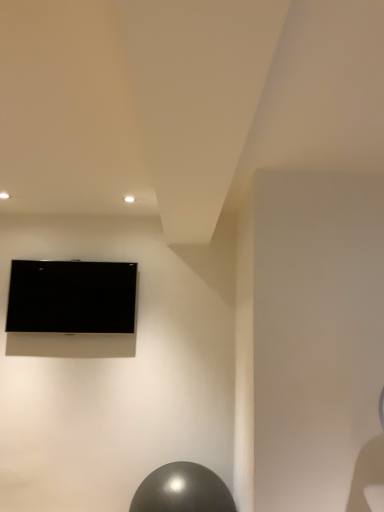
The width and height of the screenshot is (384, 512). Find the location of `black glossy tv at upper left`. black glossy tv at upper left is located at coordinates point(71,297).

What is the approximate height of black glossy tv at upper left?

The height of black glossy tv at upper left is 54.38 centimeters.

This screenshot has width=384, height=512. Describe the element at coordinates (71, 297) in the screenshot. I see `black glossy tv at upper left` at that location.

Image resolution: width=384 pixels, height=512 pixels. What do you see at coordinates (182, 490) in the screenshot?
I see `glossy metallic ball at lower center` at bounding box center [182, 490].

The width and height of the screenshot is (384, 512). In order to click on glossy metallic ball at lower center in this screenshot , I will do `click(182, 490)`.

Identify the location of black glossy tv at upper left. (71, 297).

Which is more to the left, black glossy tv at upper left or glossy metallic ball at lower center?

black glossy tv at upper left.

Does black glossy tv at upper left lie behind glossy metallic ball at lower center?

Yes, black glossy tv at upper left is further from the viewer.

Which is in front, point (39, 276) or point (209, 489)?

Positioned in front is point (209, 489).

From the image's perspective, which is below, black glossy tv at upper left or glossy metallic ball at lower center?

glossy metallic ball at lower center is shown below in the image.

From the picture: From a real-world perspective, is black glossy tv at upper left on glossy metallic ball at lower center?

Yes, from a real-world perspective, black glossy tv at upper left is above glossy metallic ball at lower center.

Can you confirm if black glossy tv at upper left is thinner than glossy metallic ball at lower center?

Indeed, black glossy tv at upper left has a lesser width compared to glossy metallic ball at lower center.

Considering the sizes of black glossy tv at upper left and glossy metallic ball at lower center in the image, is black glossy tv at upper left taller or shorter than glossy metallic ball at lower center?

black glossy tv at upper left is taller than glossy metallic ball at lower center.

Does black glossy tv at upper left have a smaller size compared to glossy metallic ball at lower center?

Correct, black glossy tv at upper left occupies less space than glossy metallic ball at lower center.

Could glossy metallic ball at lower center be considered to be inside black glossy tv at upper left?

Definitely not — glossy metallic ball at lower center is not inside black glossy tv at upper left.

Is black glossy tv at upper left with glossy metallic ball at lower center?

No.

Is black glossy tv at upper left positioned with its back to glossy metallic ball at lower center?

No.

How much distance is there between black glossy tv at upper left and glossy metallic ball at lower center?

3.96 feet.

The width and height of the screenshot is (384, 512). I want to click on ball in front of the black glossy tv at upper left, so click(182, 490).

In the image, is glossy metallic ball at lower center on the left side or the right side of black glossy tv at upper left?

glossy metallic ball at lower center is to the right of black glossy tv at upper left.

Between glossy metallic ball at lower center and black glossy tv at upper left, which one is positioned in front?

glossy metallic ball at lower center.

Considering the positions of point (177, 498) and point (131, 319), is point (177, 498) closer or farther from the camera than point (131, 319)?

Point (177, 498) is positioned closer to the camera compared to point (131, 319).

From the image's perspective, which object appears higher, glossy metallic ball at lower center or black glossy tv at upper left?

From the image's view, black glossy tv at upper left is above.

From a real-world perspective, is glossy metallic ball at lower center under black glossy tv at upper left?

Correct, in the physical world, glossy metallic ball at lower center is lower than black glossy tv at upper left.

In terms of width, does glossy metallic ball at lower center look wider or thinner when compared to black glossy tv at upper left?

Considering their sizes, glossy metallic ball at lower center looks broader than black glossy tv at upper left.

Can you confirm if glossy metallic ball at lower center is shorter than black glossy tv at upper left?

Yes, glossy metallic ball at lower center is shorter than black glossy tv at upper left.

Can you confirm if glossy metallic ball at lower center is smaller than black glossy tv at upper left?

No, glossy metallic ball at lower center is not smaller than black glossy tv at upper left.

Is glossy metallic ball at lower center located outside black glossy tv at upper left?

Yes, glossy metallic ball at lower center is not within black glossy tv at upper left.

Are glossy metallic ball at lower center and black glossy tv at upper left far apart?

Yes, glossy metallic ball at lower center is far from black glossy tv at upper left.

Is glossy metallic ball at lower center turned away from black glossy tv at upper left?

No, glossy metallic ball at lower center's orientation is not away from black glossy tv at upper left.

Locate an element on the screen. The width and height of the screenshot is (384, 512). ball to the right of black glossy tv at upper left is located at coordinates (182, 490).

Image resolution: width=384 pixels, height=512 pixels. In order to click on television above the glossy metallic ball at lower center (from a real-world perspective) in this screenshot , I will do `click(71, 297)`.

The width and height of the screenshot is (384, 512). Identify the location of television located above the glossy metallic ball at lower center (from the image's perspective). (71, 297).